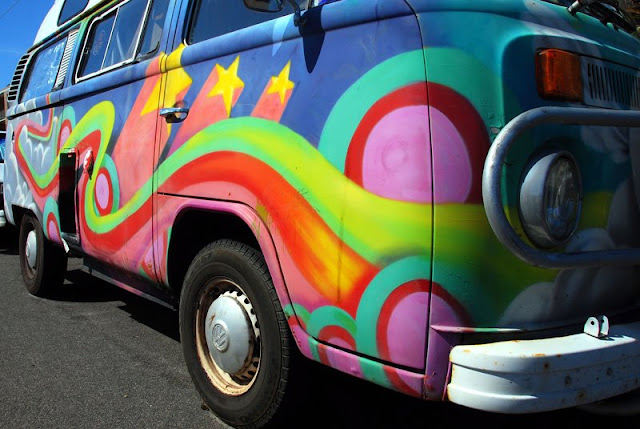
What are the coordinates of `door handle` in the screenshot? It's located at (177, 119).